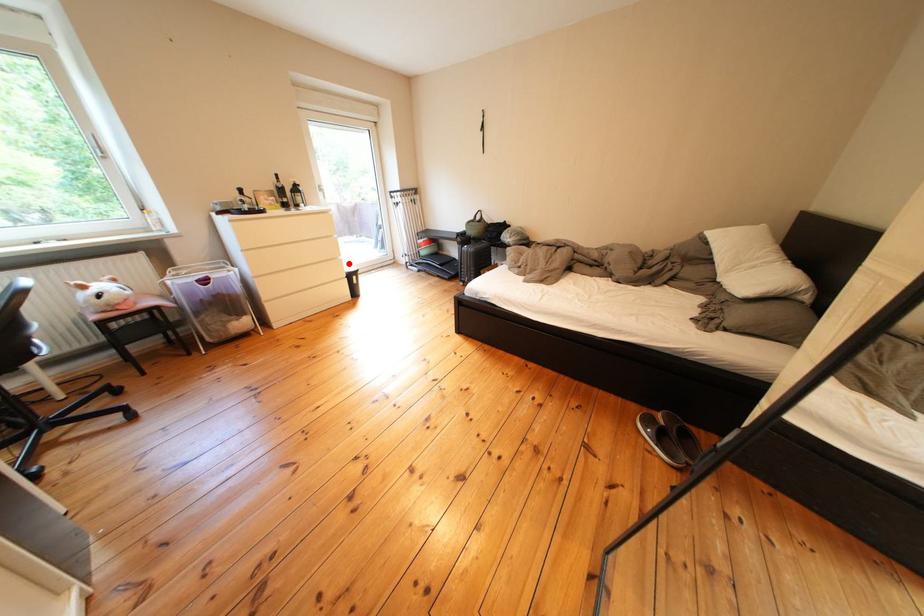
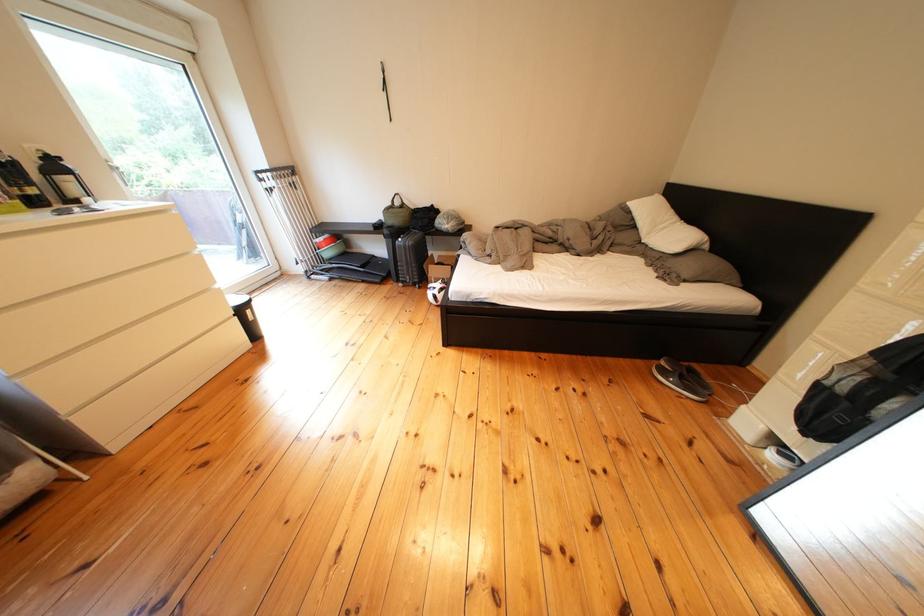
In the second image, find the point that corresponds to the highlighted location in the first image.

(220, 294)